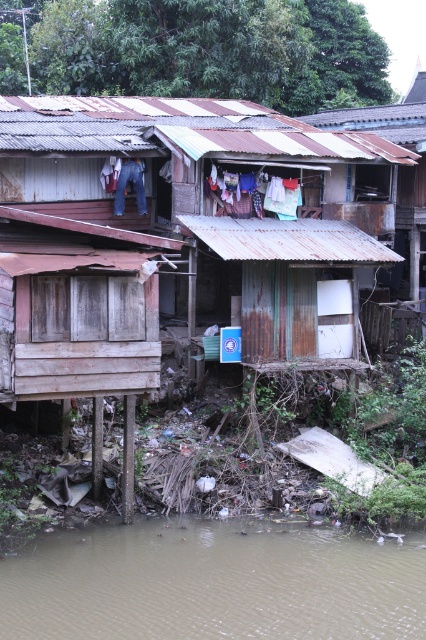
Who is positioned more to the left, rusty corrugated metal hut at center or brown muddy water at lower center?

From the viewer's perspective, rusty corrugated metal hut at center appears more on the left side.

Is point (85, 124) farther from viewer compared to point (397, 596)?

That is True.

Is point (150, 136) farther from camera compared to point (164, 538)?

Yes.

The height and width of the screenshot is (640, 426). In order to click on rusty corrugated metal hut at center in this screenshot , I will do `click(169, 232)`.

In the scene shown: Does rusty corrugated metal hut at center have a greater height compared to white fabric at center?

Indeed, rusty corrugated metal hut at center has a greater height compared to white fabric at center.

Can you confirm if rusty corrugated metal hut at center is wider than white fabric at center?

Indeed, rusty corrugated metal hut at center has a greater width compared to white fabric at center.

Measure the distance between point [135,132] and camera.

A distance of 24.95 meters exists between point [135,132] and camera.

Locate an element on the screen. This screenshot has height=640, width=426. rusty corrugated metal hut at center is located at coordinates (169, 232).

Who is more forward, (396, 593) or (287, 186)?

Point (396, 593) is in front.

Does point (376, 563) lie in front of point (284, 204)?

Yes.

Where is `brown muddy water at lower center`? The width and height of the screenshot is (426, 640). brown muddy water at lower center is located at coordinates (213, 582).